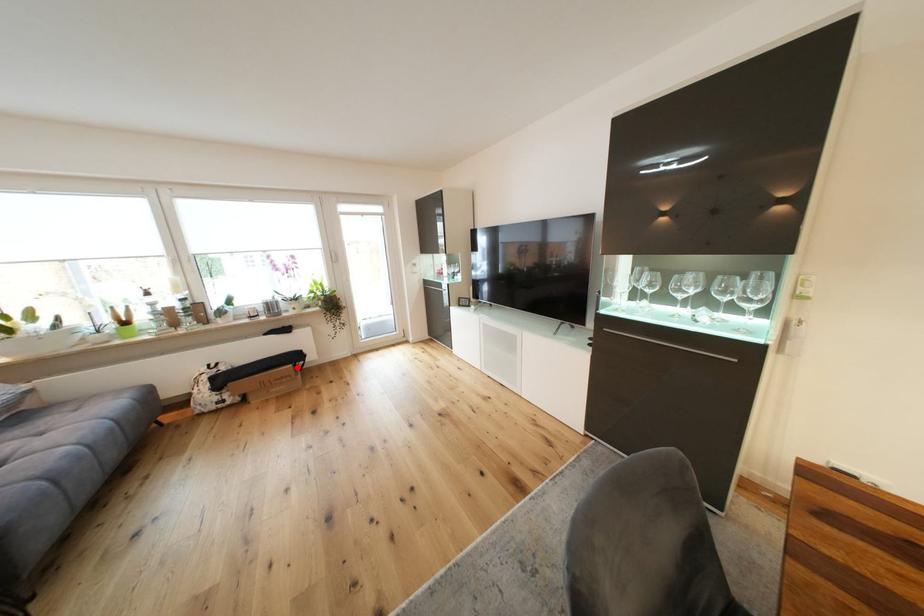
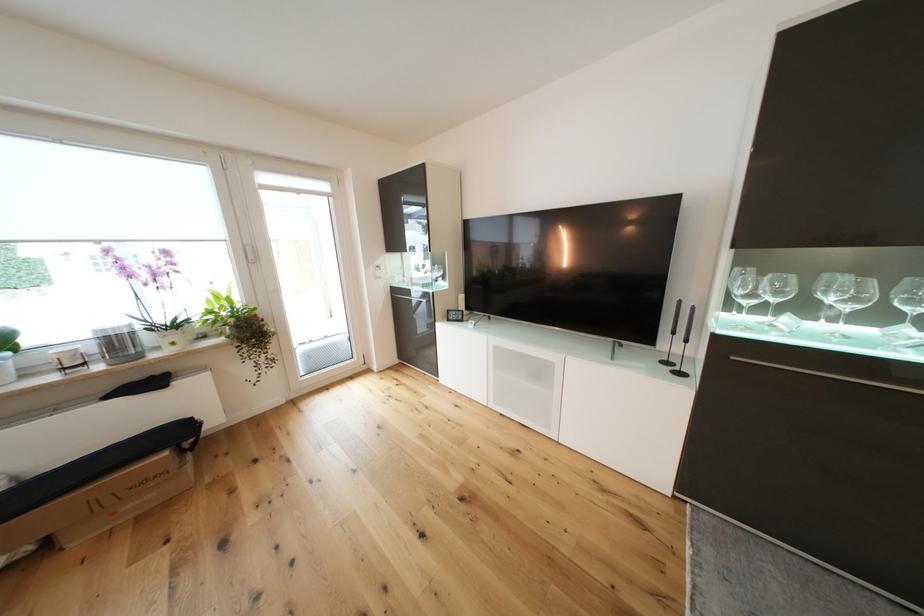
In the second image, find the point that corresponds to the highlighted location in the first image.

(172, 455)